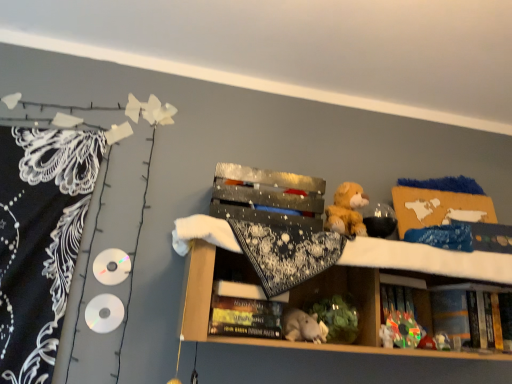
The image size is (512, 384). Identify the location of empty space that is ontop of black lace blanket at left (from a real-world perspective). (92, 81).